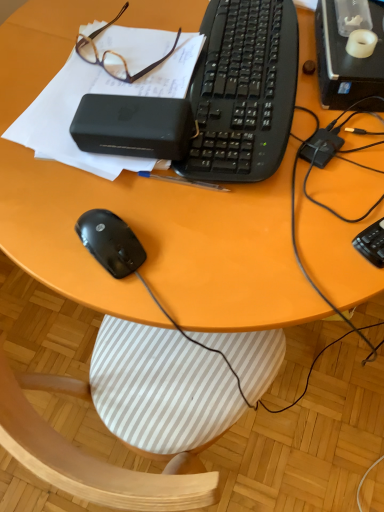
Locate an element on the screen. The width and height of the screenshot is (384, 512). vacant space behind black plastic keyboard at right, the 1th computer keyboard viewed from the front is located at coordinates (342, 145).